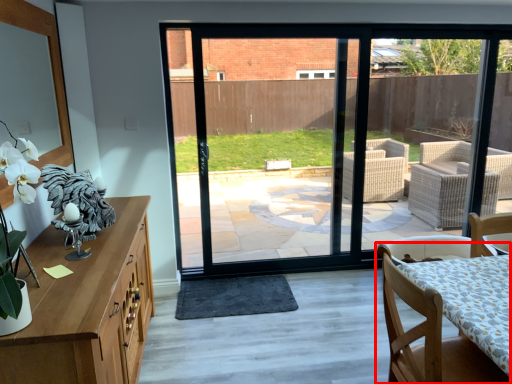
Question: From the image's perspective, considering the relative positions of chair (annotated by the red box) and wide in the image provided, where is chair (annotated by the red box) located with respect to the staircase?

Choices:
 (A) below
 (B) above

Answer: (B)